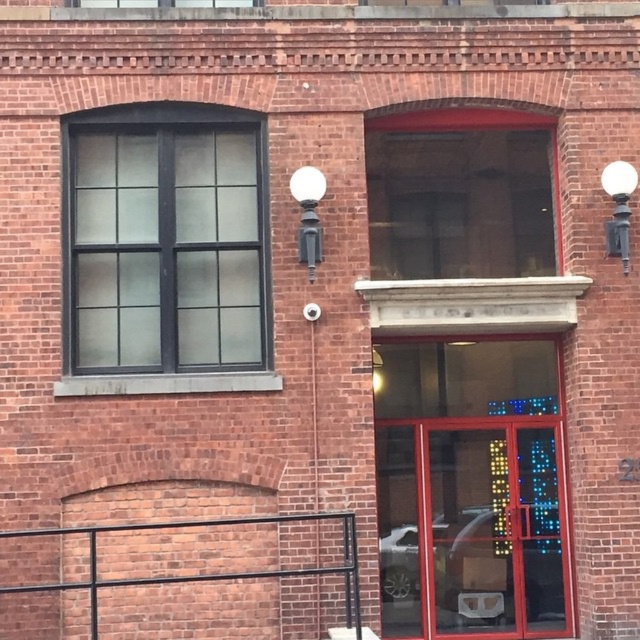
Question: Is black glass window at upper left to the right of white glossy streetlamp at upper center from the viewer's perspective?

Choices:
 (A) no
 (B) yes

Answer: (A)

Question: Which point is farther from the camera taking this photo?

Choices:
 (A) (205, 285)
 (B) (618, 196)
 (C) (314, 244)

Answer: (A)

Question: Which object is positioned farthest from the white glossy streetlamp at upper center?

Choices:
 (A) white glossy streetlamp at upper right
 (B) black glass window at upper left

Answer: (A)

Question: Can you confirm if black glass window at upper left is positioned to the right of white glossy streetlamp at upper right?

Choices:
 (A) no
 (B) yes

Answer: (A)

Question: Is black glass window at upper left to the right of white glossy streetlamp at upper right from the viewer's perspective?

Choices:
 (A) yes
 (B) no

Answer: (B)

Question: Which object is positioned farthest from the white glossy streetlamp at upper right?

Choices:
 (A) white glossy streetlamp at upper center
 (B) black glass window at upper left

Answer: (B)